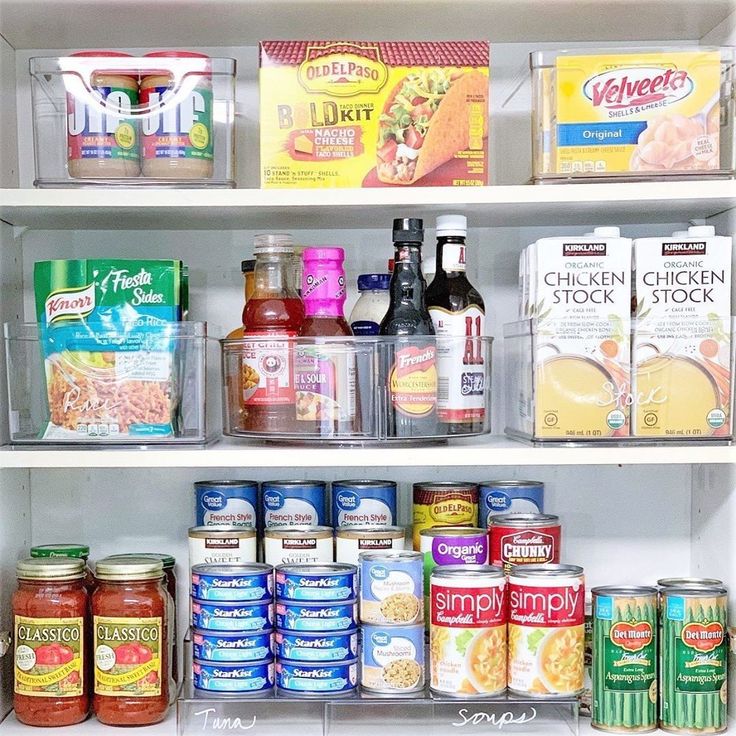
In order to click on storage orgainizers in this screenshot , I will do `click(166, 146)`, `click(609, 143)`, `click(173, 394)`, `click(325, 396)`, `click(603, 355)`, `click(481, 712)`, `click(297, 720)`.